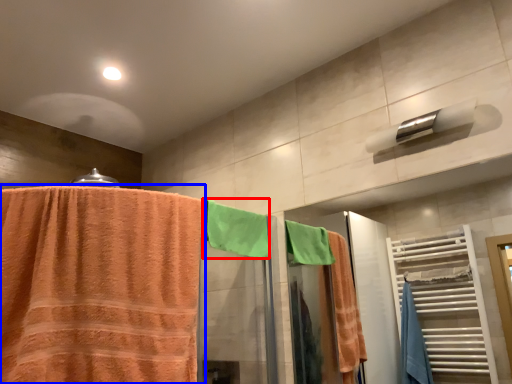
Question: Among these objects, which one is nearest to the camera, beach towel (highlighted by a red box) or towel (highlighted by a blue box)?

Choices:
 (A) beach towel
 (B) towel

Answer: (B)